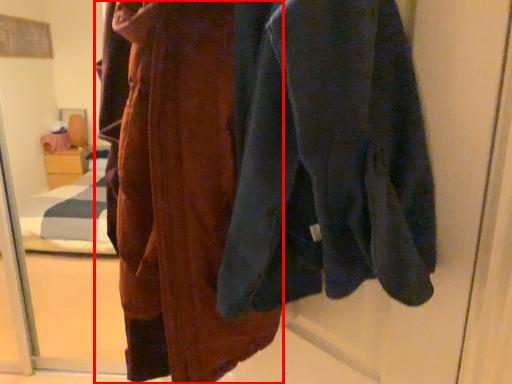
Question: From the image's perspective, what is the correct spatial relationship of fancy dress (annotated by the red box) in relation to sweatshirt?

Choices:
 (A) above
 (B) below

Answer: (B)